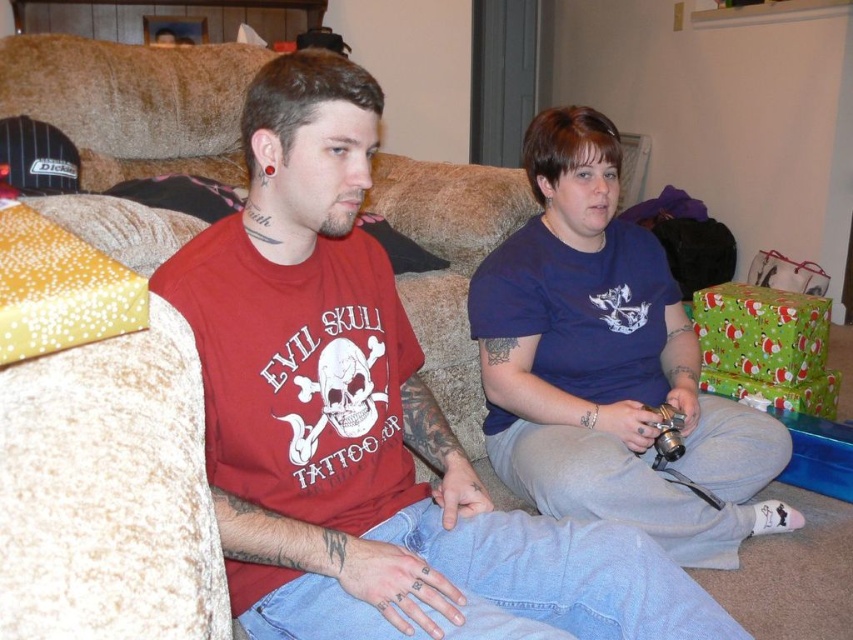
Can you confirm if blue cotton shirt at center is taller than metallic silver game controller at lower center?

Yes.

This screenshot has height=640, width=853. Describe the element at coordinates (608, 364) in the screenshot. I see `blue cotton shirt at center` at that location.

You are a GUI agent. You are given a task and a screenshot of the screen. Output one action in this format:
    pyautogui.click(x=<x>, y=<y>)
    Task: Click on the blue cotton shirt at center
    
    Given the screenshot: What is the action you would take?
    pyautogui.click(x=608, y=364)

Does point (263, 248) come closer to viewer compared to point (622, 484)?

That is True.

You are a GUI agent. You are given a task and a screenshot of the screen. Output one action in this format:
    pyautogui.click(x=<x>, y=<y>)
    Task: Click on the red matte t-shirt at center
    The height and width of the screenshot is (640, 853).
    Given the screenshot: What is the action you would take?
    pyautogui.click(x=368, y=420)

Identify the location of red matte t-shirt at center. (368, 420).

Who is positioned more to the left, red matte t-shirt at center or metallic silver game controller at lower center?

Positioned to the left is red matte t-shirt at center.

Is red matte t-shirt at center positioned before metallic silver game controller at lower center?

Yes, it is in front of metallic silver game controller at lower center.

Is point (320, 531) in front of point (675, 433)?

Yes, it is in front of point (675, 433).

Find the location of `red matte t-shirt at center`. red matte t-shirt at center is located at coordinates (368, 420).